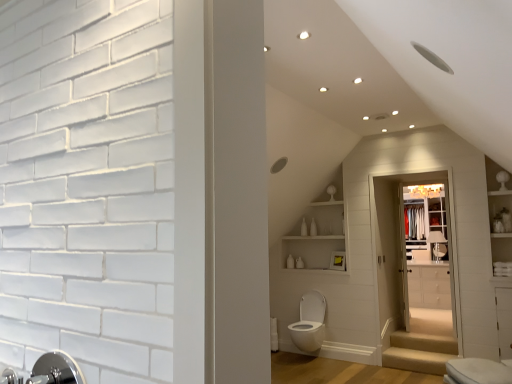
This screenshot has width=512, height=384. Describe the element at coordinates (437, 245) in the screenshot. I see `silver metallic faucet at lower left` at that location.

Where is `beige fabric stair at lower right, marked as the 1th stairwell in a bottom-to-top arrangement`? The height and width of the screenshot is (384, 512). beige fabric stair at lower right, marked as the 1th stairwell in a bottom-to-top arrangement is located at coordinates (419, 352).

What do you see at coordinates (419, 352) in the screenshot? I see `beige fabric stair at lower right, marked as the 1th stairwell in a bottom-to-top arrangement` at bounding box center [419, 352].

This screenshot has height=384, width=512. What do you see at coordinates (318, 230) in the screenshot?
I see `white glossy shelves at upper center` at bounding box center [318, 230].

How much space does white glossy toilet at lower center, positioned as the 2th toilet in front-to-back order, occupy vertically?

white glossy toilet at lower center, positioned as the 2th toilet in front-to-back order, is 29.69 inches in height.

At what (x,y) coordinates should I click in order to perform the action: click on white glossy toilet at lower center, positioned as the first toilet in back-to-front order. Please return your answer as a coordinate pair (x, y). The height and width of the screenshot is (384, 512). Looking at the image, I should click on (309, 322).

In order to face white glossy toilet at lower right, marked as the first toilet in a front-to-back arrangement, should I rotate leftwards or rightwards?

You should rotate right by 28.727 degrees.

What is the approximate width of clear glass closet door at center?

10.06 centimeters.

The height and width of the screenshot is (384, 512). What do you see at coordinates (429, 285) in the screenshot? I see `white glossy cabinet at center` at bounding box center [429, 285].

Find the location of a particular element. Image resolution: width=512 pixels, height=384 pixels. white glossy cabinet at center is located at coordinates (429, 285).

Locate an element on the screen. This screenshot has height=384, width=512. silver metallic faucet at lower left is located at coordinates (437, 245).

How many degrees apart are the facing directions of white glossy medicine cabinet at upper center and beige carpeted stairs at lower center, which is the second stairwell in bottom-to-top order?

The angle between the facing direction of white glossy medicine cabinet at upper center and the facing direction of beige carpeted stairs at lower center, which is the second stairwell in bottom-to-top order, is 1.45 degrees.

Is white glossy medicine cabinet at upper center bigger than beige carpeted stairs at lower center, which appears as the 1th stairwell when viewed from the top?

Yes, white glossy medicine cabinet at upper center is bigger than beige carpeted stairs at lower center, which appears as the 1th stairwell when viewed from the top.

From the image's perspective, would you say white glossy medicine cabinet at upper center is shown under beige carpeted stairs at lower center, which is the second stairwell in bottom-to-top order?

No.

Would you say white glossy medicine cabinet at upper center is outside beige carpeted stairs at lower center, which is the second stairwell in bottom-to-top order?

Yes, white glossy medicine cabinet at upper center is not within beige carpeted stairs at lower center, which is the second stairwell in bottom-to-top order.

In the scene shown: Which of these two, white glossy toilet at lower center, which is the first toilet in left-to-right order, or beige carpeted stairs at lower center, which is the second stairwell in bottom-to-top order, is thinner?

beige carpeted stairs at lower center, which is the second stairwell in bottom-to-top order.

Is white glossy toilet at lower center, which is the first toilet in left-to-right order, facing towards beige carpeted stairs at lower center, which is the second stairwell in bottom-to-top order?

No.

Can you confirm if white glossy toilet at lower center, positioned as the 2th toilet in front-to-back order, is smaller than beige carpeted stairs at lower center, which appears as the 1th stairwell when viewed from the top?

No.

Is white glossy toilet at lower center, positioned as the first toilet in back-to-front order, not close to beige carpeted stairs at lower center, which is the second stairwell in bottom-to-top order?

Indeed, white glossy toilet at lower center, positioned as the first toilet in back-to-front order, is not near beige carpeted stairs at lower center, which is the second stairwell in bottom-to-top order.

The height and width of the screenshot is (384, 512). In order to click on glass door that is behind the white glossy toilet at lower center, which is the second toilet in right-to-left order in this screenshot , I will do `click(430, 236)`.

Between clear glass closet door at center and white glossy toilet at lower center, positioned as the first toilet in back-to-front order, which one has smaller size?

clear glass closet door at center is smaller.

In terms of height, does clear glass closet door at center look taller or shorter compared to white glossy toilet at lower center, positioned as the first toilet in back-to-front order?

Considering their sizes, clear glass closet door at center has more height than white glossy toilet at lower center, positioned as the first toilet in back-to-front order.

From a real-world perspective, is clear glass closet door at center over white glossy toilet at lower center, positioned as the first toilet in back-to-front order?

Yes, from a real-world perspective, clear glass closet door at center is above white glossy toilet at lower center, positioned as the first toilet in back-to-front order.

Is silver metallic faucet at lower left facing towards white glossy medicine cabinet at upper center?

No, silver metallic faucet at lower left is not facing towards white glossy medicine cabinet at upper center.

Based on the photo, considering the relative sizes of silver metallic faucet at lower left and white glossy medicine cabinet at upper center in the image provided, is silver metallic faucet at lower left thinner than white glossy medicine cabinet at upper center?

Yes, silver metallic faucet at lower left is thinner than white glossy medicine cabinet at upper center.

Could white glossy medicine cabinet at upper center be considered to be inside silver metallic faucet at lower left?

No, white glossy medicine cabinet at upper center is not surrounded by silver metallic faucet at lower left.

Considering the positions of point (431, 236) and point (440, 222), is point (431, 236) closer or farther from the camera than point (440, 222)?

Clearly, point (431, 236) is more distant from the camera than point (440, 222).

Between point (443, 271) and point (440, 237), which one is positioned in front?

Positioned in front is point (440, 237).

From a real-world perspective, is white glossy cabinet at center positioned under silver metallic faucet at lower left based on gravity?

Yes.

Is white glossy cabinet at center taller or shorter than silver metallic faucet at lower left?

Considering their sizes, white glossy cabinet at center has more height than silver metallic faucet at lower left.

From the image's perspective, does white glossy cabinet at center appear lower than silver metallic faucet at lower left?

Yes, from the image's perspective, white glossy cabinet at center is beneath silver metallic faucet at lower left.

Which is correct: white glossy toilet at lower center, which is the second toilet in right-to-left order, is inside white glossy cabinet at center, or outside of it?

white glossy toilet at lower center, which is the second toilet in right-to-left order, exists outside the volume of white glossy cabinet at center.

In terms of width, does white glossy toilet at lower center, positioned as the 2th toilet in front-to-back order, look wider or thinner when compared to white glossy cabinet at center?

Considering their sizes, white glossy toilet at lower center, positioned as the 2th toilet in front-to-back order, looks slimmer than white glossy cabinet at center.

Considering the sizes of objects beige carpeted stairs at lower center, which appears as the 1th stairwell when viewed from the top, and white glossy toilet at lower center, which is the second toilet in right-to-left order, in the image provided, who is smaller, beige carpeted stairs at lower center, which appears as the 1th stairwell when viewed from the top, or white glossy toilet at lower center, which is the second toilet in right-to-left order,?

beige carpeted stairs at lower center, which appears as the 1th stairwell when viewed from the top.

Locate an element on the screen. stairwell that is the 1st one below the white glossy toilet at lower center, which is the second toilet in right-to-left order (from a real-world perspective) is located at coordinates (424, 342).

Considering the relative positions of beige carpeted stairs at lower center, which appears as the 1th stairwell when viewed from the top, and white glossy toilet at lower center, which is the first toilet in left-to-right order, in the image provided, is beige carpeted stairs at lower center, which appears as the 1th stairwell when viewed from the top, to the left of white glossy toilet at lower center, which is the first toilet in left-to-right order, from the viewer's perspective?

No, beige carpeted stairs at lower center, which appears as the 1th stairwell when viewed from the top, is not to the left of white glossy toilet at lower center, which is the first toilet in left-to-right order.

Which of these two, beige carpeted stairs at lower center, which is the second stairwell in bottom-to-top order, or white glossy toilet at lower center, positioned as the first toilet in back-to-front order, is wider?

white glossy toilet at lower center, positioned as the first toilet in back-to-front order, is wider.

Find the location of a particular element. the 1st stairwell positioned below the white glossy medicine cabinet at upper center (from the image's perspective) is located at coordinates (424, 342).

You are a GUI agent. You are given a task and a screenshot of the screen. Output one action in this format:
    pyautogui.click(x=<x>, y=<y>)
    Task: Click on the toilet behind the beige carpeted stairs at lower center, which is the second stairwell in bottom-to-top order
    This screenshot has height=384, width=512.
    Given the screenshot: What is the action you would take?
    pyautogui.click(x=309, y=322)

From the image, which object appears to be farther from white glossy toilet at lower center, which is the second toilet in right-to-left order, white glossy medicine cabinet at upper center or white glossy shelves at upper center?

The object further to white glossy toilet at lower center, which is the second toilet in right-to-left order, is white glossy medicine cabinet at upper center.

From the image, which object appears to be nearer to silver metallic faucet at lower left, beige fabric stair at lower right, marked as the second stairwell in a top-to-bottom arrangement, or white glossy toilet at lower center, positioned as the first toilet in back-to-front order?

beige fabric stair at lower right, marked as the second stairwell in a top-to-bottom arrangement.

Considering their positions, is white glossy shelves at upper center positioned further to silver metallic faucet at lower left than beige carpeted stairs at lower center, which is the second stairwell in bottom-to-top order?

The object further to silver metallic faucet at lower left is white glossy shelves at upper center.

When comparing their distances from clear glass closet door at center, does beige fabric stair at lower right, marked as the 1th stairwell in a bottom-to-top arrangement, or silver metallic faucet at lower left seem closer?

The object closer to clear glass closet door at center is silver metallic faucet at lower left.

Looking at the image, which one is located further to white glossy cabinet at center, silver metallic faucet at lower left or beige carpeted stairs at lower center, which appears as the 1th stairwell when viewed from the top?

The object further to white glossy cabinet at center is beige carpeted stairs at lower center, which appears as the 1th stairwell when viewed from the top.

From the image, which object appears to be nearer to beige carpeted stairs at lower center, which is the second stairwell in bottom-to-top order, white glossy toilet at lower right, positioned as the second toilet in left-to-right order, or silver metallic faucet at lower left?

Based on the image, silver metallic faucet at lower left appears to be nearer to beige carpeted stairs at lower center, which is the second stairwell in bottom-to-top order.

Which object lies further to the anchor point beige carpeted stairs at lower center, which appears as the 1th stairwell when viewed from the top, clear glass closet door at center or silver metallic faucet at lower left?

silver metallic faucet at lower left is further to beige carpeted stairs at lower center, which appears as the 1th stairwell when viewed from the top.

Which object lies nearer to the anchor point white glossy shelves at upper center, white glossy medicine cabinet at upper center or clear glass closet door at center?

The object closer to white glossy shelves at upper center is white glossy medicine cabinet at upper center.

Identify the location of glass door between white glossy toilet at lower right, marked as the first toilet in a right-to-left arrangement, and white glossy cabinet at center from front to back. This screenshot has height=384, width=512. (430, 236).

Where is `glass door between beige carpeted stairs at lower center, which appears as the 1th stairwell when viewed from the top, and silver metallic faucet at lower left from front to back`? This screenshot has height=384, width=512. glass door between beige carpeted stairs at lower center, which appears as the 1th stairwell when viewed from the top, and silver metallic faucet at lower left from front to back is located at coordinates point(430,236).

The width and height of the screenshot is (512, 384). In order to click on cabinetry between white glossy toilet at lower center, which is the second toilet in right-to-left order, and white glossy medicine cabinet at upper center, along the z-axis in this screenshot , I will do `click(429, 285)`.

The height and width of the screenshot is (384, 512). Find the location of `shelf located between white glossy toilet at lower center, positioned as the 2th toilet in front-to-back order, and silver metallic faucet at lower left in the left-right direction`. shelf located between white glossy toilet at lower center, positioned as the 2th toilet in front-to-back order, and silver metallic faucet at lower left in the left-right direction is located at coordinates (318, 230).